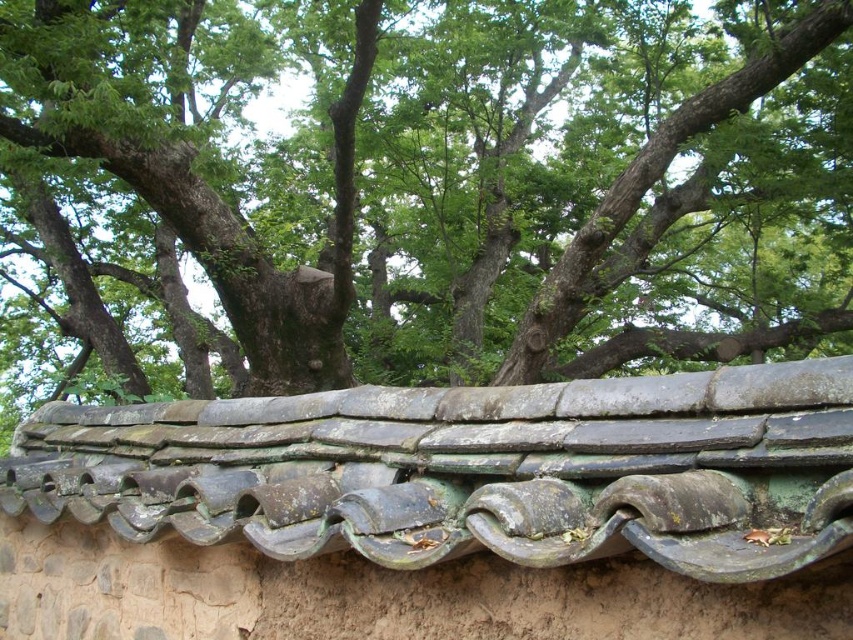
Can you confirm if green leafy tree at upper center is shorter than greenish-brown clay tiles at center?

Incorrect, green leafy tree at upper center's height does not fall short of greenish-brown clay tiles at center's.

Describe the element at coordinates (422, 189) in the screenshot. The height and width of the screenshot is (640, 853). I see `green leafy tree at upper center` at that location.

Who is more distant from viewer, (12, 246) or (722, 385)?

Positioned behind is point (12, 246).

This screenshot has width=853, height=640. Find the location of `green leafy tree at upper center`. green leafy tree at upper center is located at coordinates (422, 189).